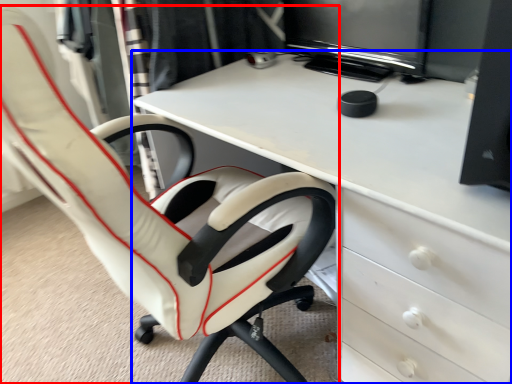
Question: Among these objects, which one is nearest to the camera, chair (highlighted by a red box) or desk (highlighted by a blue box)?

Choices:
 (A) chair
 (B) desk

Answer: (A)